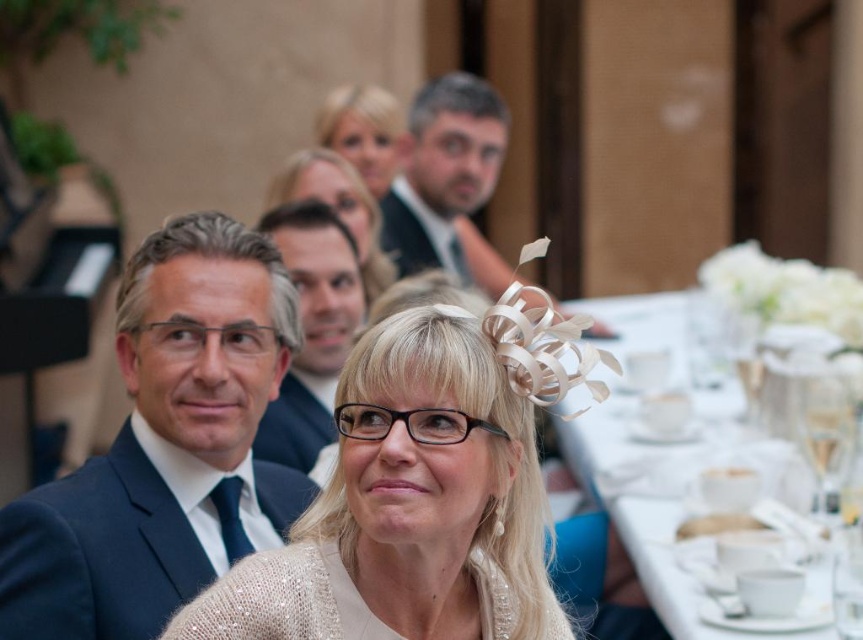
You are a photographer at the event and want to capture a photo of both the matte black hair at center and the blonde hair at upper center. Based on their positions, which person should you focus on first to ensure both are in frame?

The matte black hair at center is wider than the blonde hair at upper center, so focusing on the matte black hair at center first would ensure both are in frame since it occupies more space.